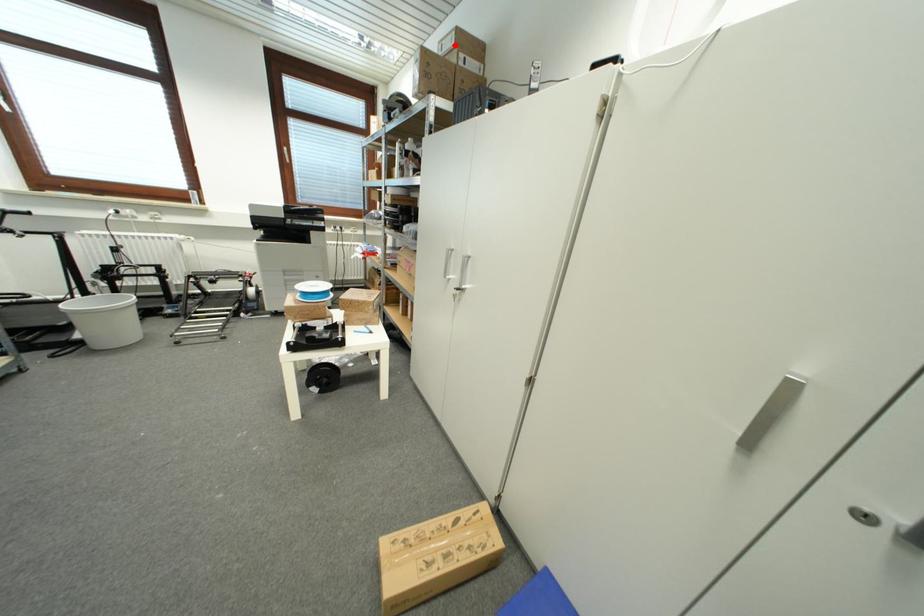
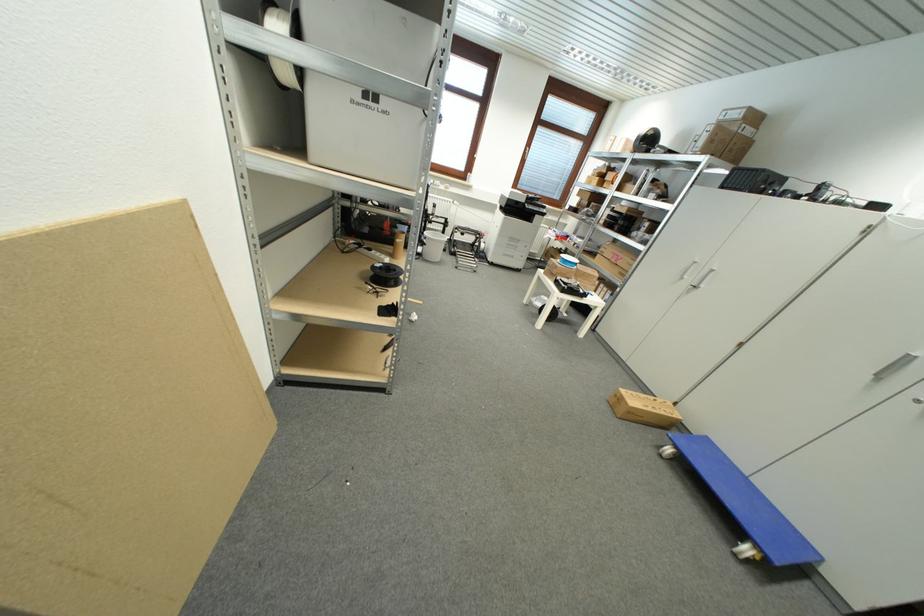
The point at the highlighted location is marked in the first image. Where is the corresponding point in the second image?

(742, 116)